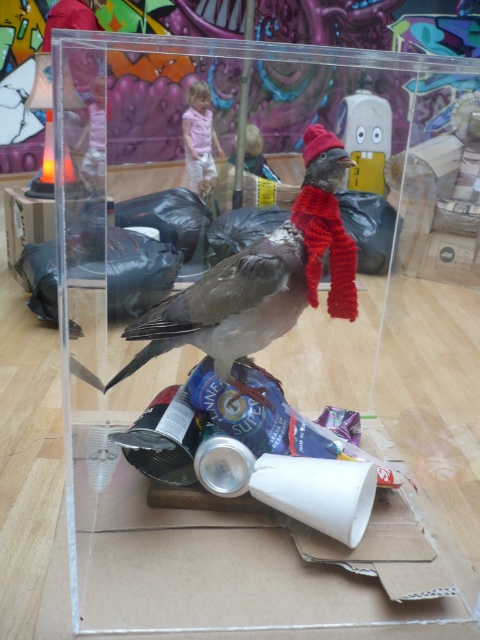
Is point (218, 272) less distant than point (370, 99)?

Yes.

Who is higher up, matte gray bird at center or rubber duck at center?

rubber duck at center is higher up.

Which is in front, point (178, 333) or point (381, 113)?

Positioned in front is point (178, 333).

The image size is (480, 640). In order to click on matte gray bird at center in this screenshot , I will do `click(263, 278)`.